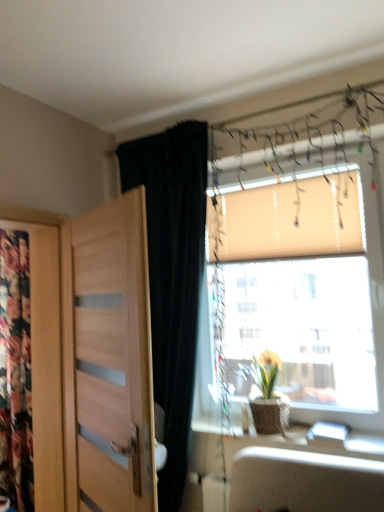
The width and height of the screenshot is (384, 512). What are the coordinates of `blank space situated above beige fabric blind at upper right (from a real-world perspective)` in the screenshot? It's located at (278, 181).